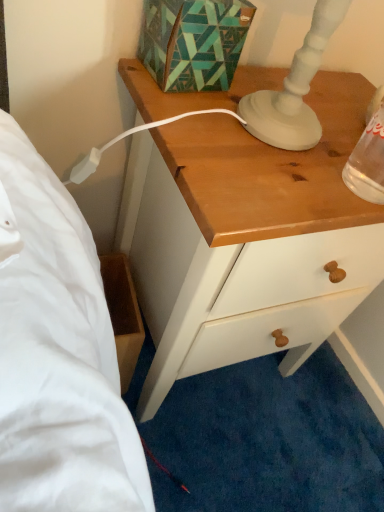
At what (x,y) coordinates should I click in order to perform the action: click on empty space that is ontop of wooden nightstand at upper right. Please return your answer as a coordinate pair (x, y). This screenshot has height=512, width=384. Looking at the image, I should click on (289, 140).